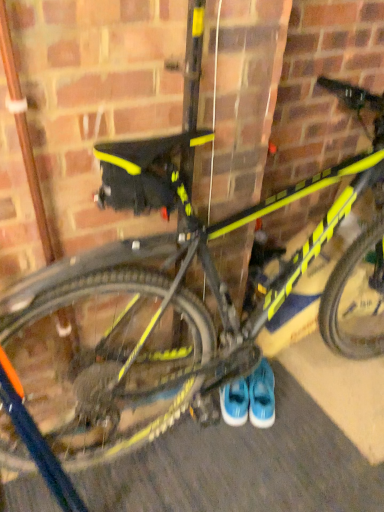
The image size is (384, 512). Describe the element at coordinates (262, 396) in the screenshot. I see `blue suede sneakers at center, which ranks as the second footwear in left-to-right order` at that location.

What do you see at coordinates (265, 449) in the screenshot?
I see `rubberized asphalt at lower center` at bounding box center [265, 449].

Image resolution: width=384 pixels, height=512 pixels. Find the location of `blue suede sneakers at center, the 1th footwear positioned from the right`. blue suede sneakers at center, the 1th footwear positioned from the right is located at coordinates (262, 396).

From a real-world perspective, does rubberized asphalt at lower center sit lower than blue suede sneakers at center, the 1th footwear positioned from the right?

Yes, from a real-world perspective, rubberized asphalt at lower center is beneath blue suede sneakers at center, the 1th footwear positioned from the right.

Is rubberized asphalt at lower center far from blue suede sneakers at center, which ranks as the second footwear in left-to-right order?

No, rubberized asphalt at lower center is not far away from blue suede sneakers at center, which ranks as the second footwear in left-to-right order.

Considering the positions of point (45, 502) and point (250, 402), is point (45, 502) closer or farther from the camera than point (250, 402)?

Point (45, 502) is closer to the camera than point (250, 402).

Would you say blue suede sneakers at center, which ranks as the second footwear in left-to-right order, is part of rubberized asphalt at lower center's contents?

No.

Which is in front, point (332, 482) or point (221, 397)?

The point (332, 482) is closer to the camera.

Does rubberized asphalt at lower center have a greater height compared to blue suede sneakers at center, which is the first footwear in left-to-right order?

Incorrect, the height of rubberized asphalt at lower center is not larger of that of blue suede sneakers at center, which is the first footwear in left-to-right order.

Between rubberized asphalt at lower center and blue suede sneakers at center, which is the first footwear in left-to-right order, which one has smaller size?

Smaller between the two is blue suede sneakers at center, which is the first footwear in left-to-right order.

From the image's perspective, is rubberized asphalt at lower center under blue suede sneakers at center, which ranks as the 2th footwear in right-to-left order?

Yes.

Is blue suede sneakers at center, which ranks as the second footwear in left-to-right order, with blue suede sneakers at center, which is the first footwear in left-to-right order?

Indeed, blue suede sneakers at center, which ranks as the second footwear in left-to-right order, and blue suede sneakers at center, which is the first footwear in left-to-right order, are beside each other and touching.

Considering the sizes of blue suede sneakers at center, the 1th footwear positioned from the right, and blue suede sneakers at center, which is the first footwear in left-to-right order, in the image, is blue suede sneakers at center, the 1th footwear positioned from the right, bigger or smaller than blue suede sneakers at center, which is the first footwear in left-to-right order,?

blue suede sneakers at center, the 1th footwear positioned from the right, is bigger than blue suede sneakers at center, which is the first footwear in left-to-right order.

From the image's perspective, is blue suede sneakers at center, the 1th footwear positioned from the right, on blue suede sneakers at center, which ranks as the 2th footwear in right-to-left order?

Actually, blue suede sneakers at center, the 1th footwear positioned from the right, appears below blue suede sneakers at center, which ranks as the 2th footwear in right-to-left order, in the image.

From a real-world perspective, is blue suede sneakers at center, the 1th footwear positioned from the right, positioned above or below blue suede sneakers at center, which ranks as the 2th footwear in right-to-left order?

In terms of real-world spatial position, blue suede sneakers at center, the 1th footwear positioned from the right, is below blue suede sneakers at center, which ranks as the 2th footwear in right-to-left order.

Which object is positioned more to the left, blue suede sneakers at center, which ranks as the 2th footwear in right-to-left order, or blue suede sneakers at center, which ranks as the second footwear in left-to-right order?

blue suede sneakers at center, which ranks as the 2th footwear in right-to-left order.

From a real-world perspective, is blue suede sneakers at center, which ranks as the 2th footwear in right-to-left order, on blue suede sneakers at center, which ranks as the second footwear in left-to-right order?

Yes, from a real-world perspective, blue suede sneakers at center, which ranks as the 2th footwear in right-to-left order, is over blue suede sneakers at center, which ranks as the second footwear in left-to-right order

From the image's perspective, does blue suede sneakers at center, which ranks as the 2th footwear in right-to-left order, appear lower than blue suede sneakers at center, which ranks as the second footwear in left-to-right order?

No, from the image's perspective, blue suede sneakers at center, which ranks as the 2th footwear in right-to-left order, is not below blue suede sneakers at center, which ranks as the second footwear in left-to-right order.

Does point (233, 411) appear closer or farther from the camera than point (261, 376)?

Point (233, 411).

Is blue suede sneakers at center, which ranks as the second footwear in left-to-right order, thinner than rubberized asphalt at lower center?

Correct, the width of blue suede sneakers at center, which ranks as the second footwear in left-to-right order, is less than that of rubberized asphalt at lower center.

Are blue suede sneakers at center, which ranks as the second footwear in left-to-right order, and rubberized asphalt at lower center far apart?

They are positioned close to each other.

Is blue suede sneakers at center, which ranks as the second footwear in left-to-right order, inside the boundaries of rubberized asphalt at lower center, or outside?

blue suede sneakers at center, which ranks as the second footwear in left-to-right order, cannot be found inside rubberized asphalt at lower center.

Could you measure the distance between blue suede sneakers at center, which ranks as the 2th footwear in right-to-left order, and rubberized asphalt at lower center?

They are 10.72 inches apart.

Looking at this image, is the position of blue suede sneakers at center, which is the first footwear in left-to-right order, less distant than that of rubberized asphalt at lower center?

No, blue suede sneakers at center, which is the first footwear in left-to-right order, is behind rubberized asphalt at lower center.

Could you tell me if blue suede sneakers at center, which is the first footwear in left-to-right order, is facing rubberized asphalt at lower center?

No, blue suede sneakers at center, which is the first footwear in left-to-right order, is not facing towards rubberized asphalt at lower center.

How many degrees apart are the facing directions of blue suede sneakers at center, which is the first footwear in left-to-right order, and rubberized asphalt at lower center?

blue suede sneakers at center, which is the first footwear in left-to-right order, and rubberized asphalt at lower center are facing 124 degrees away from each other.

Identify the location of the 1st footwear directly above the rubberized asphalt at lower center (from a real-world perspective). The width and height of the screenshot is (384, 512). (262, 396).

Locate an element on the screen. The image size is (384, 512). footwear that is the 2nd object located above the rubberized asphalt at lower center (from the image's perspective) is located at coordinates (235, 402).

Considering their positions, is blue suede sneakers at center, which ranks as the second footwear in left-to-right order, positioned closer to rubberized asphalt at lower center than blue suede sneakers at center, which ranks as the 2th footwear in right-to-left order?

Based on the image, blue suede sneakers at center, which ranks as the second footwear in left-to-right order, appears to be nearer to rubberized asphalt at lower center.

Considering their positions, is blue suede sneakers at center, which is the first footwear in left-to-right order, positioned closer to blue suede sneakers at center, the 1th footwear positioned from the right, than rubberized asphalt at lower center?

blue suede sneakers at center, which is the first footwear in left-to-right order, is positioned closer to the anchor blue suede sneakers at center, the 1th footwear positioned from the right.

Which object lies nearer to the anchor point blue suede sneakers at center, which is the first footwear in left-to-right order, blue suede sneakers at center, which ranks as the second footwear in left-to-right order, or rubberized asphalt at lower center?

Among the two, blue suede sneakers at center, which ranks as the second footwear in left-to-right order, is located nearer to blue suede sneakers at center, which is the first footwear in left-to-right order.

Which object lies further to the anchor point rubberized asphalt at lower center, blue suede sneakers at center, which is the first footwear in left-to-right order, or blue suede sneakers at center, the 1th footwear positioned from the right?

blue suede sneakers at center, which is the first footwear in left-to-right order, is positioned further to the anchor rubberized asphalt at lower center.

Looking at the image, which one is located further to blue suede sneakers at center, the 1th footwear positioned from the right, rubberized asphalt at lower center or blue suede sneakers at center, which is the first footwear in left-to-right order?

The object further to blue suede sneakers at center, the 1th footwear positioned from the right, is rubberized asphalt at lower center.

Estimate the real-world distances between objects in this image. Which object is closer to blue suede sneakers at center, which ranks as the 2th footwear in right-to-left order, rubberized asphalt at lower center or blue suede sneakers at center, which ranks as the second footwear in left-to-right order?

blue suede sneakers at center, which ranks as the second footwear in left-to-right order, is positioned closer to the anchor blue suede sneakers at center, which ranks as the 2th footwear in right-to-left order.

The image size is (384, 512). In order to click on footwear between rubberized asphalt at lower center and blue suede sneakers at center, which is the first footwear in left-to-right order, in the front-back direction in this screenshot , I will do `click(262, 396)`.